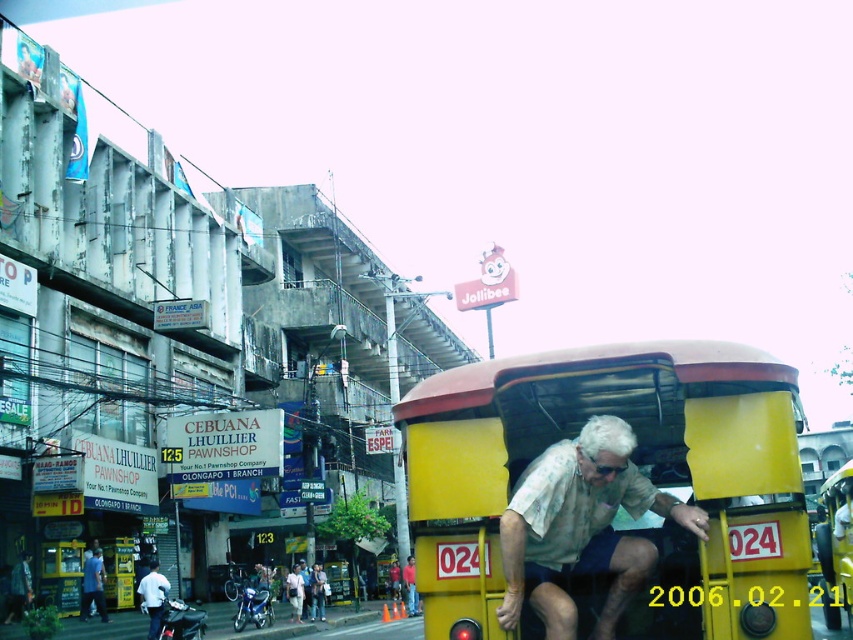
Looking at this image, is white matte coach at lower left closer to the viewer compared to light brown leather jacket at lower center?

Yes.

Who is more forward, (157, 608) or (311, 593)?

Positioned in front is point (157, 608).

Which is behind, point (152, 621) or point (318, 579)?

The point (318, 579) is more distant.

Locate an element on the screen. white matte coach at lower left is located at coordinates (154, 596).

Is point (248, 620) less distant than point (146, 577)?

No, it is behind (146, 577).

Can you confirm if blue metallic motorcycle at lower left is smaller than white matte coach at lower left?

Incorrect, blue metallic motorcycle at lower left is not smaller in size than white matte coach at lower left.

Between point (236, 618) and point (148, 593), which one is positioned in front?

Point (148, 593) is in front.

You are a GUI agent. You are given a task and a screenshot of the screen. Output one action in this format:
    pyautogui.click(x=<x>, y=<y>)
    Task: Click on the blue metallic motorcycle at lower left
    
    Given the screenshot: What is the action you would take?
    pyautogui.click(x=254, y=600)

Is light brown fabric shirt at center smaller than light brown fabric shirt at lower center?

No, light brown fabric shirt at center is not smaller than light brown fabric shirt at lower center.

Does point (645, 509) come farther from viewer compared to point (299, 579)?

No.

What are the coordinates of `light brown fabric shirt at center` in the screenshot? It's located at (581, 528).